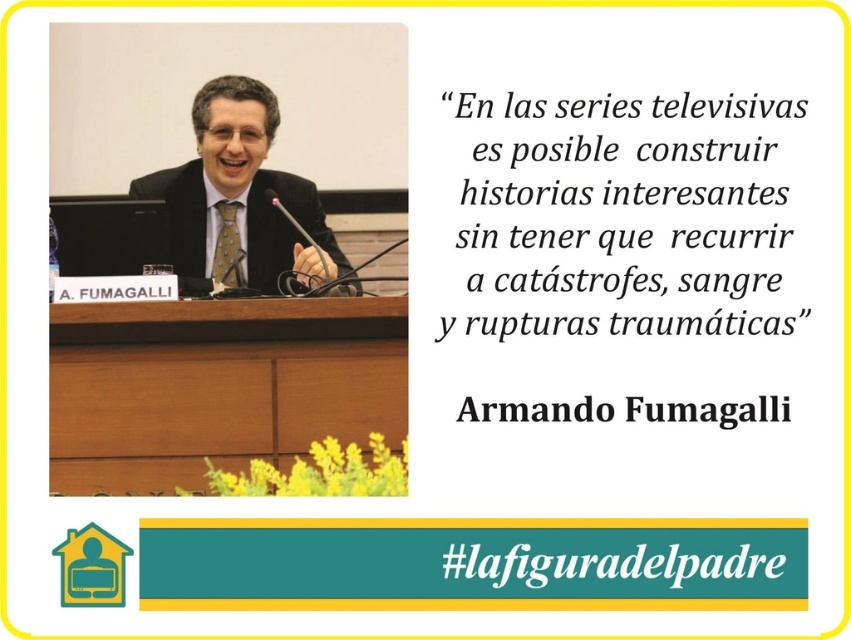
Is point (101, 248) positioned in front of point (463, 400)?

That is False.

Between matte black laptop at lower left and black text at center, which one is positioned higher?

matte black laptop at lower left is above.

Find the location of `matte black laptop at lower left`. matte black laptop at lower left is located at coordinates (107, 234).

How much distance is there between matte black suit at center and matte black laptop at lower left?

38.52 centimeters

Between matte black suit at center and matte black laptop at lower left, which one appears on the right side from the viewer's perspective?

From the viewer's perspective, matte black suit at center appears more on the right side.

You are a GUI agent. You are given a task and a screenshot of the screen. Output one action in this format:
    pyautogui.click(x=<x>, y=<y>)
    Task: Click on the matte black suit at center
    
    Given the screenshot: What is the action you would take?
    pyautogui.click(x=238, y=196)

Consider the image. Is matte black suit at center closer to the viewer compared to #black paper at upper center?

That is False.

In the scene shown: Between matte black suit at center and #black paper at upper center, which one is positioned lower?

#black paper at upper center is lower down.

Is point (250, 280) more distant than point (630, 554)?

Yes, point (250, 280) is behind point (630, 554).

At what (x,y) coordinates should I click in order to perform the action: click on matte black suit at center. Please return your answer as a coordinate pair (x, y). Image resolution: width=851 pixels, height=640 pixels. Looking at the image, I should click on (238, 196).